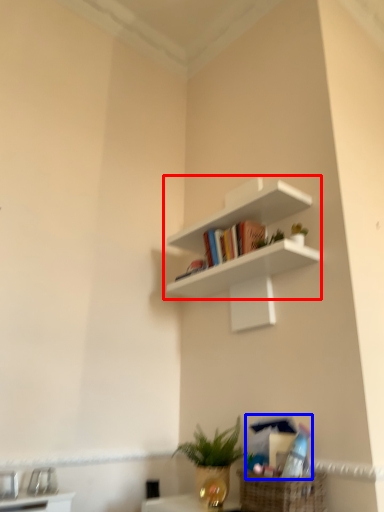
Question: Which object is closer to the camera taking this photo, shelf (highlighted by a red box) or book (highlighted by a blue box)?

Choices:
 (A) shelf
 (B) book

Answer: (B)